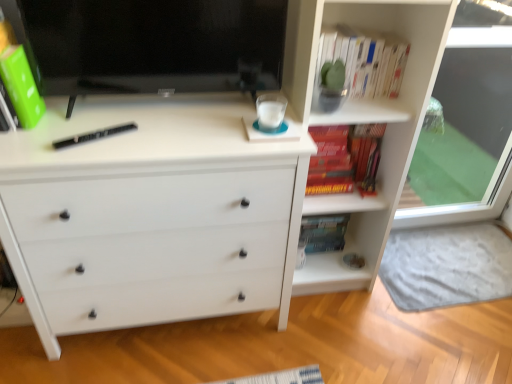
Where is `vacant space underneath matte black monitor at upper left (from a real-world perspective)`? The height and width of the screenshot is (384, 512). vacant space underneath matte black monitor at upper left (from a real-world perspective) is located at coordinates (156, 109).